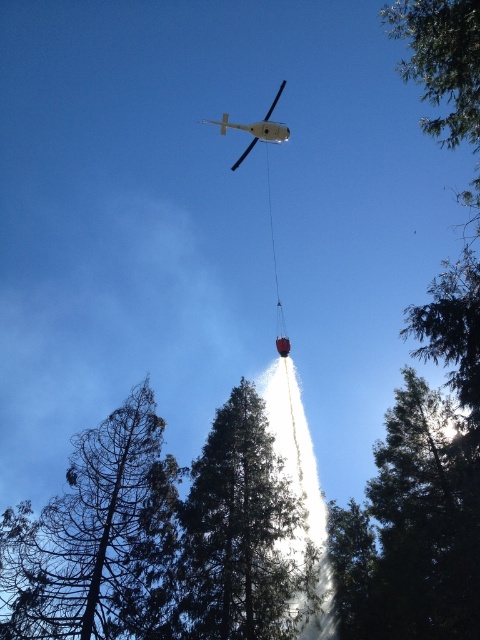
Can you confirm if green textured tree at center is shorter than metallic silver helicopter at upper center?

Yes.

Does point (263, 616) come in front of point (203, 122)?

That is True.

Is point (255, 624) positioned in front of point (202, 120)?

That is True.

Image resolution: width=480 pixels, height=640 pixels. I want to click on green textured tree at center, so click(241, 534).

Which of these two, dark brown bark tree at lower left or green textured tree at center, stands shorter?

Standing shorter between the two is green textured tree at center.

Can you confirm if dark brown bark tree at lower left is positioned below green textured tree at center?

Indeed, dark brown bark tree at lower left is positioned under green textured tree at center.

Where is `dark brown bark tree at lower left`? This screenshot has height=640, width=480. dark brown bark tree at lower left is located at coordinates [95, 536].

Does dark brown bark tree at lower left appear under metallic silver helicopter at upper center?

Indeed, dark brown bark tree at lower left is positioned under metallic silver helicopter at upper center.

Is dark brown bark tree at lower left smaller than metallic silver helicopter at upper center?

Correct, dark brown bark tree at lower left occupies less space than metallic silver helicopter at upper center.

Between point (85, 444) and point (280, 93), which one is positioned behind?

Positioned behind is point (280, 93).

This screenshot has height=640, width=480. I want to click on dark brown bark tree at lower left, so click(95, 536).